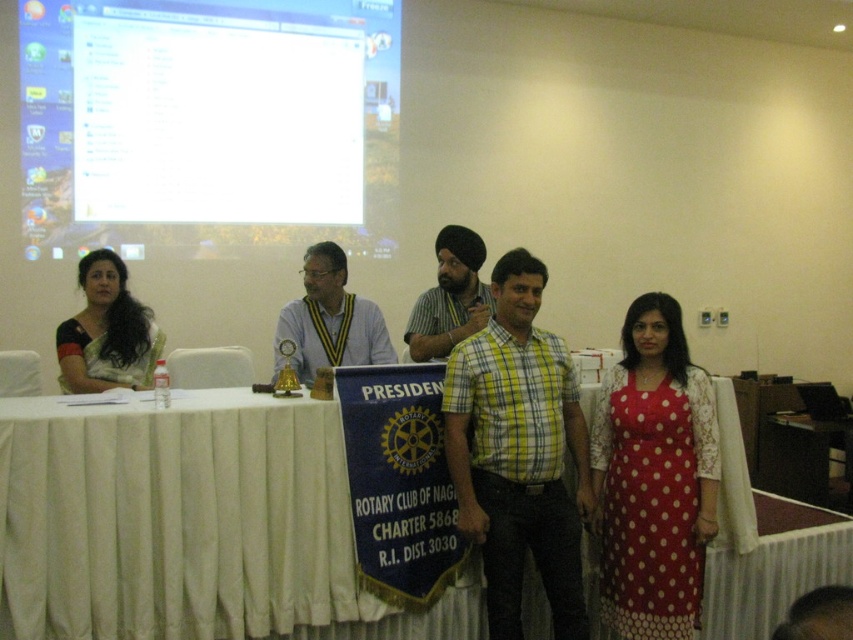
Is white glossy screen at upper left further to the viewer compared to matte green shirt at center?

Yes, white glossy screen at upper left is behind matte green shirt at center.

Is white glossy screen at upper left positioned in front of matte green shirt at center?

No, it is behind matte green shirt at center.

Find the location of a particular element. white glossy screen at upper left is located at coordinates (207, 125).

Can you confirm if red polka dot dress at right is shorter than matte green shirt at center?

No, red polka dot dress at right is not shorter than matte green shirt at center.

Locate an element on the screen. This screenshot has width=853, height=640. red polka dot dress at right is located at coordinates (653, 476).

Between sari at left and matte yellow and black striped tie at center, which one has more height?

Standing taller between the two is matte yellow and black striped tie at center.

Who is positioned more to the right, sari at left or matte yellow and black striped tie at center?

Positioned to the right is matte yellow and black striped tie at center.

Which is in front, point (83, 362) or point (288, 307)?

Positioned in front is point (83, 362).

Where is `sari at left`? sari at left is located at coordinates (106, 332).